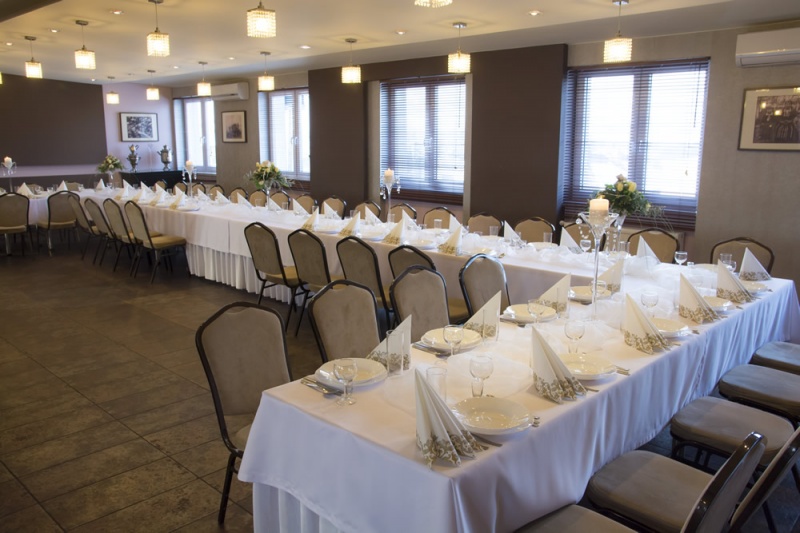
Locate an element on the screen. windows is located at coordinates pos(194,127), pos(296,128), pos(417,140), pos(598,134).